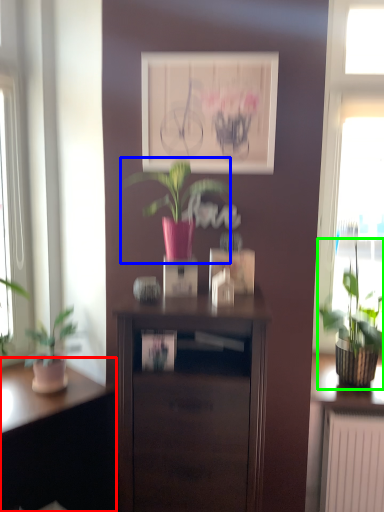
Question: Which is farther away from desk (highlighted by a red box)? houseplant (highlighted by a blue box) or houseplant (highlighted by a green box)?

Choices:
 (A) houseplant
 (B) houseplant

Answer: (B)